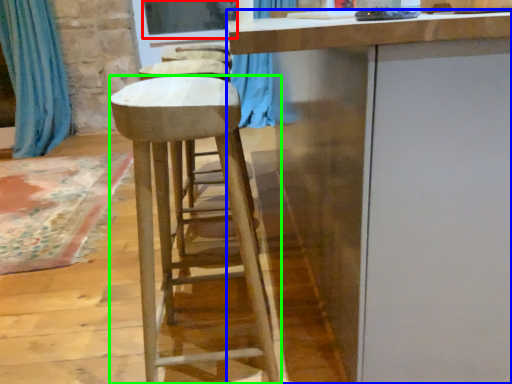
Question: Which object is positioned farthest from window screen (highlighted by a red box)? Select from cabinetry (highlighted by a blue box) and stool (highlighted by a green box).

Choices:
 (A) cabinetry
 (B) stool

Answer: (A)